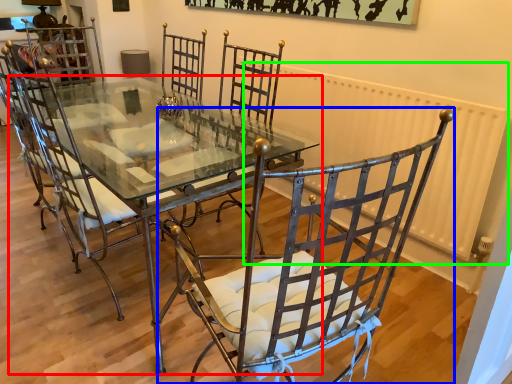
Question: Estimate the real-world distances between objects in this image. Which object is farther from table (highlighted by a red box), chair (highlighted by a blue box) or radiator (highlighted by a green box)?

Choices:
 (A) chair
 (B) radiator

Answer: (B)